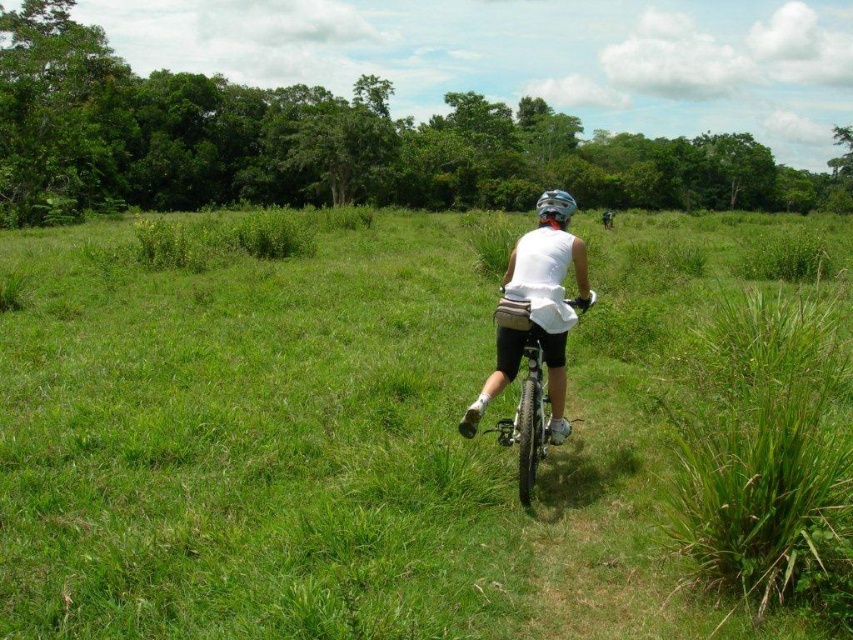
Question: Which of the following is the closest to the observer?

Choices:
 (A) white matte helmet at center
 (B) matte black helmet at center
 (C) matte black bicycle at center
 (D) white matte shirt at center

Answer: (C)

Question: Does green grassy at center appear on the right side of white matte helmet at center?

Choices:
 (A) yes
 (B) no

Answer: (B)

Question: Is green grassy at center to the left of matte black bicycle at center from the viewer's perspective?

Choices:
 (A) yes
 (B) no

Answer: (B)

Question: Which point appears farthest from the camera in this image?

Choices:
 (A) (538, 212)
 (B) (230, 444)
 (C) (524, 404)

Answer: (A)

Question: Where is green grassy at center located in relation to matte black bicycle at center in the image?

Choices:
 (A) below
 (B) above

Answer: (B)

Question: Among these points, which one is farthest from the camera?

Choices:
 (A) (607, 227)
 (B) (564, 193)
 (C) (541, 422)
 (D) (25, 388)

Answer: (A)